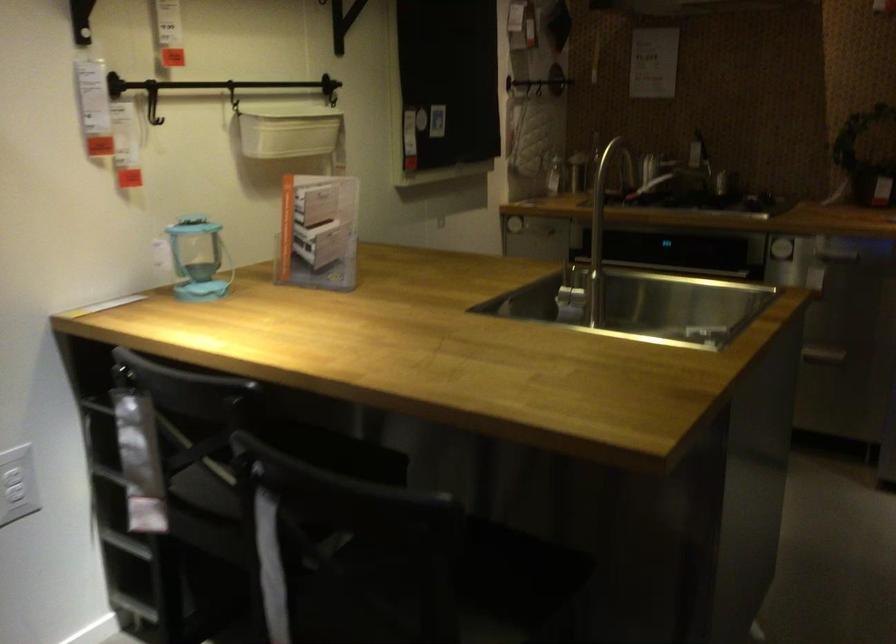
The image size is (896, 644). Find the location of `black wall hook`. black wall hook is located at coordinates (152, 100).